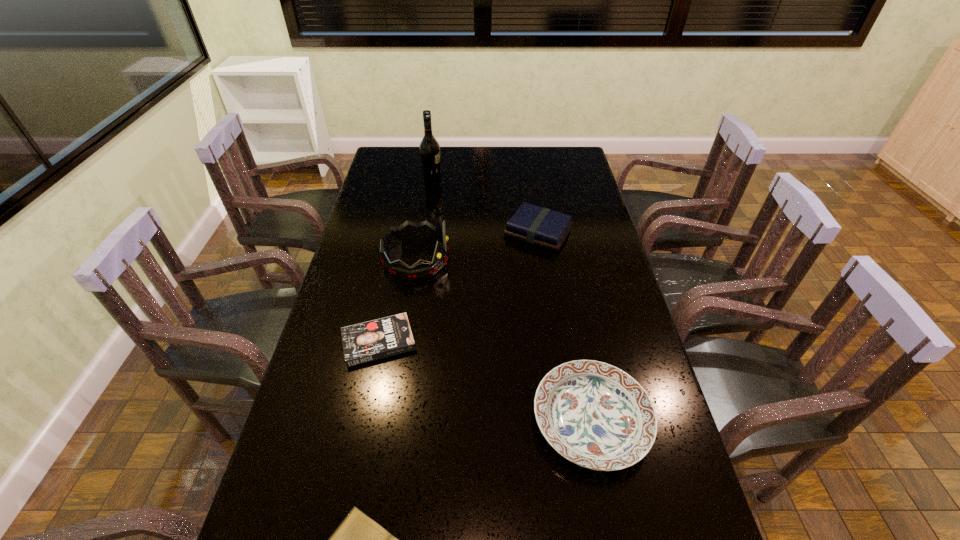
At what (x,y) coordinates should I click in order to perform the action: click on free space located 0.230m on the left of the rightmost book. Please return your answer as a coordinate pair (x, y). Looking at the image, I should click on (441, 232).

Identify the location of vacant space located on the left of the fifth farthest object. The height and width of the screenshot is (540, 960). (419, 420).

At what (x,y) coordinates should I click in order to perform the action: click on blank space located on the back of the second nearest book. Please return your answer as a coordinate pair (x, y). Looking at the image, I should click on (390, 290).

Where is `object that is at the far edge`? object that is at the far edge is located at coordinates (429, 148).

Find the location of a particular element. The image size is (960, 540). tiara present at the left edge is located at coordinates (408, 231).

Identify the location of book present at the left edge. The image size is (960, 540). (368, 341).

Where is `book at the right edge`? The width and height of the screenshot is (960, 540). book at the right edge is located at coordinates (536, 225).

Where is `plate present at the right edge`? plate present at the right edge is located at coordinates (597, 416).

This screenshot has width=960, height=540. I want to click on vacant space at the far edge of the desktop, so click(516, 154).

Find the location of a particular element. free region at the left edge of the desktop is located at coordinates (348, 282).